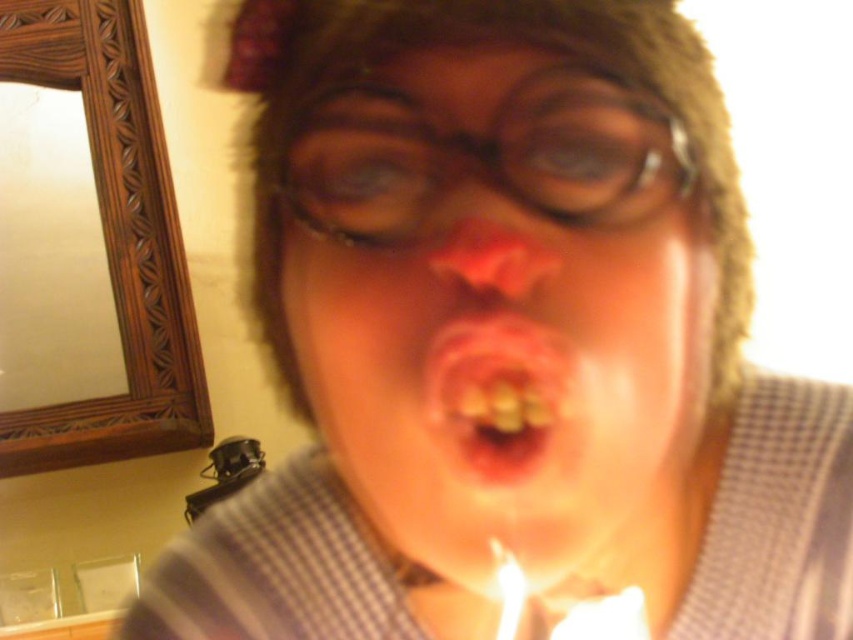
Between matte skin face at center and yellowish plastic teeth at center, which one is positioned higher?

matte skin face at center

Does matte skin face at center appear under yellowish plastic teeth at center?

Incorrect, matte skin face at center is not positioned below yellowish plastic teeth at center.

Which is in front, point (589, 300) or point (492, 371)?

Point (492, 371) is in front.

The image size is (853, 640). What are the coordinates of `matte skin face at center` in the screenshot? It's located at (492, 301).

Does black plastic glasses at center have a larger size compared to yellowish plastic teeth at center?

Correct, black plastic glasses at center is larger in size than yellowish plastic teeth at center.

Is black plastic glasses at center to the right of yellowish plastic teeth at center from the viewer's perspective?

No, black plastic glasses at center is not to the right of yellowish plastic teeth at center.

This screenshot has height=640, width=853. What do you see at coordinates (482, 150) in the screenshot?
I see `black plastic glasses at center` at bounding box center [482, 150].

Find the location of a particular element. The image size is (853, 640). black plastic glasses at center is located at coordinates (482, 150).

Does black plastic glasses at center have a larger size compared to white wax candle at lower center?

Correct, black plastic glasses at center is larger in size than white wax candle at lower center.

Between point (538, 218) and point (519, 588), which one is positioned in front?

Point (538, 218)

Does point (322, 125) come farther from viewer compared to point (514, 604)?

No, (322, 125) is closer to viewer.

Find the location of a particular element. black plastic glasses at center is located at coordinates (482, 150).